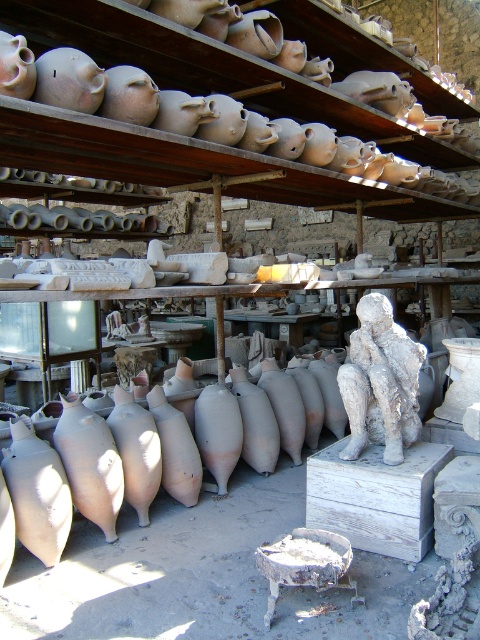
Question: Can you confirm if matte clay pots at upper center is wider than white stone statue at center?

Choices:
 (A) no
 (B) yes

Answer: (B)

Question: Where is matte clay pots at upper center located in relation to white stone statue at center in the image?

Choices:
 (A) right
 (B) left

Answer: (B)

Question: Considering the relative positions of matte clay pots at upper center and white stone statue at center in the image provided, where is matte clay pots at upper center located with respect to white stone statue at center?

Choices:
 (A) right
 (B) left

Answer: (B)